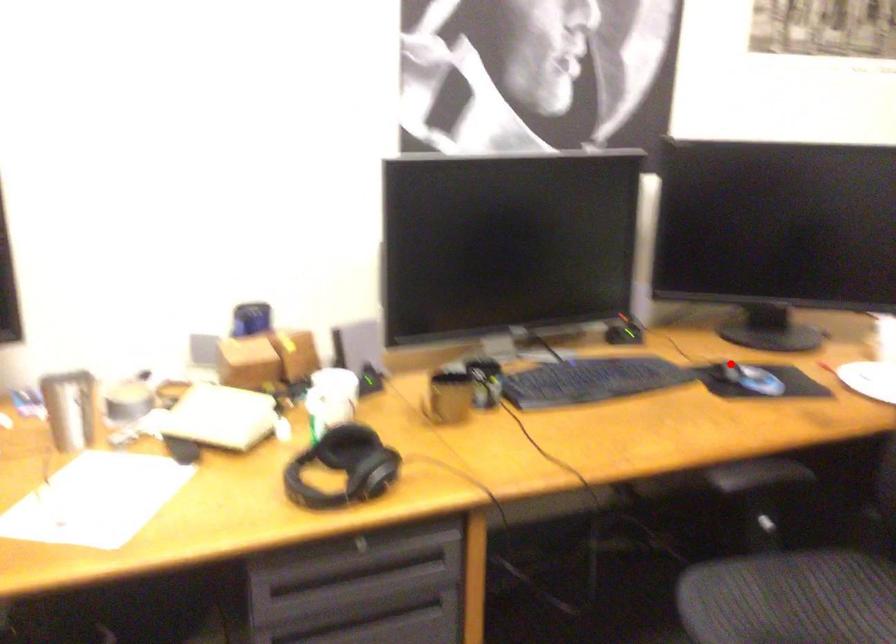
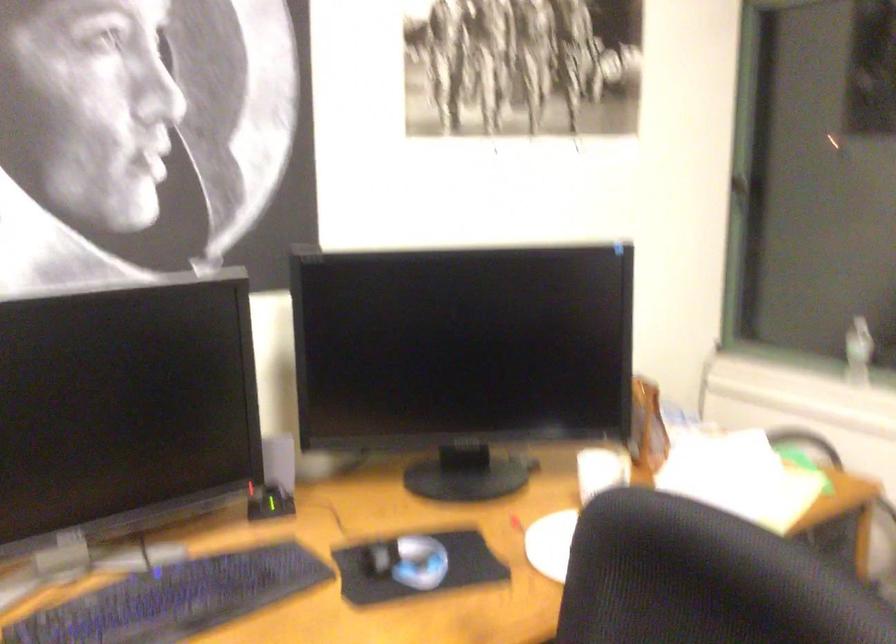
Question: I am providing you with two images of the same scene from different viewpoints. A red point is shown in image1. For the corresponding object point in image2, is it positioned nearer or farther from the camera?

Choices:
 (A) Nearer
 (B) Farther

Answer: (A)